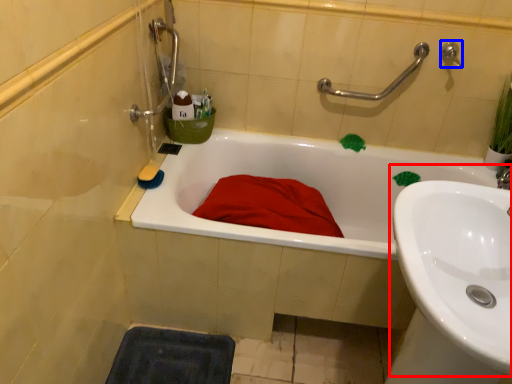
Question: Which point is closer to the camera, sink (highlighted by a red box) or plumbing fixture (highlighted by a blue box)?

Choices:
 (A) sink
 (B) plumbing fixture

Answer: (A)